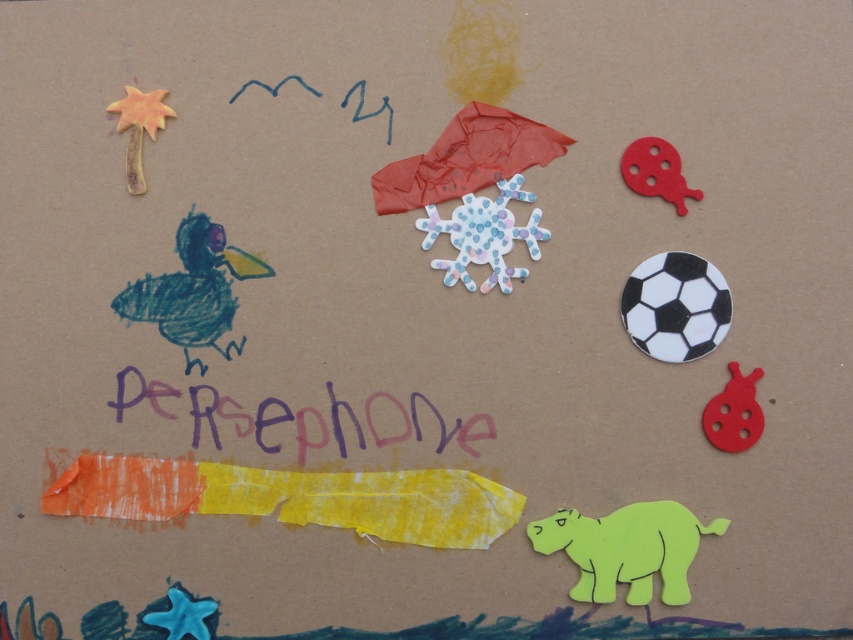
Describe the element at coordinates (625, 548) in the screenshot. Image resolution: width=853 pixels, height=640 pixels. I see `neon green paper hippo at bottom right` at that location.

Is the position of neon green paper hippo at bottom right less distant than that of red felt ladybug at upper right?

Yes, neon green paper hippo at bottom right is closer to the viewer.

What do you see at coordinates (625, 548) in the screenshot? This screenshot has height=640, width=853. I see `neon green paper hippo at bottom right` at bounding box center [625, 548].

Find the location of a particular element. This screenshot has height=640, width=853. neon green paper hippo at bottom right is located at coordinates (625, 548).

Locate an element on the screen. This screenshot has width=853, height=640. blue scribbled duck at center is located at coordinates (193, 289).

Between point (206, 272) and point (753, 372), which one is positioned in front?

Point (206, 272) is more forward.

Is point (218, 232) more distant than point (712, 419)?

No.

At what (x,y) coordinates should I click in order to perform the action: click on blue scribbled duck at center. Please return your answer as a coordinate pair (x, y). The image size is (853, 640). Looking at the image, I should click on (193, 289).

Who is more distant from viewer, (x=274, y=419) or (x=128, y=160)?

The point (x=274, y=419) is more distant.

Does purple painted text at center come in front of orange clay palm tree at upper left?

That is True.

At what (x,y) coordinates should I click in order to perform the action: click on purple painted text at center. Please return your answer as a coordinate pair (x, y). Looking at the image, I should click on (335, 422).